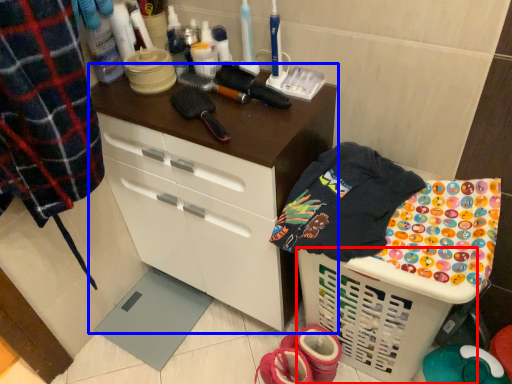
Question: Which of the following is the farthest to the observer, basket (highlighted by a red box) or cabinetry (highlighted by a blue box)?

Choices:
 (A) basket
 (B) cabinetry

Answer: (B)